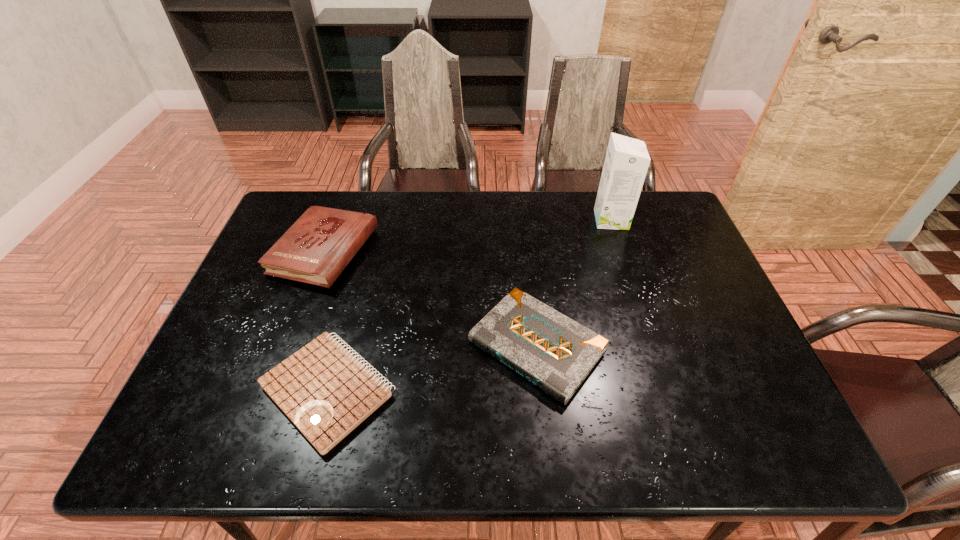
You are a GUI agent. You are given a task and a screenshot of the screen. Output one action in this format:
    pyautogui.click(x=<x>, y=<y>)
    Task: Click on the vacant space at the left edge of the desktop
    This screenshot has height=540, width=960.
    Given the screenshot: What is the action you would take?
    pyautogui.click(x=249, y=364)

This screenshot has width=960, height=540. Identify the location of free location at the right edge. (758, 373).

At what (x,y) coordinates should I click in order to perform the action: click on blank space at the far left corner of the desktop. Please return your answer as a coordinate pair (x, y). This screenshot has width=960, height=540. Looking at the image, I should click on (302, 199).

Where is `free point at the near left corner`? This screenshot has height=540, width=960. free point at the near left corner is located at coordinates (233, 428).

Where is `free space at the far right corner of the desktop`? free space at the far right corner of the desktop is located at coordinates (654, 220).

The height and width of the screenshot is (540, 960). In order to click on vacant point located between the left notebook and the third tallest object in this screenshot , I will do `click(432, 368)`.

The image size is (960, 540). Find the location of `vacant space that's between the hardback book and the carton`. vacant space that's between the hardback book and the carton is located at coordinates (468, 235).

Where is `vacant space that is in between the hardback book and the second shortest object`? This screenshot has height=540, width=960. vacant space that is in between the hardback book and the second shortest object is located at coordinates (431, 299).

Where is `free spot between the hardback book and the rightmost object`? free spot between the hardback book and the rightmost object is located at coordinates (468, 235).

Identify the location of free space between the shorter notebook and the third shortest object. This screenshot has height=540, width=960. (326, 321).